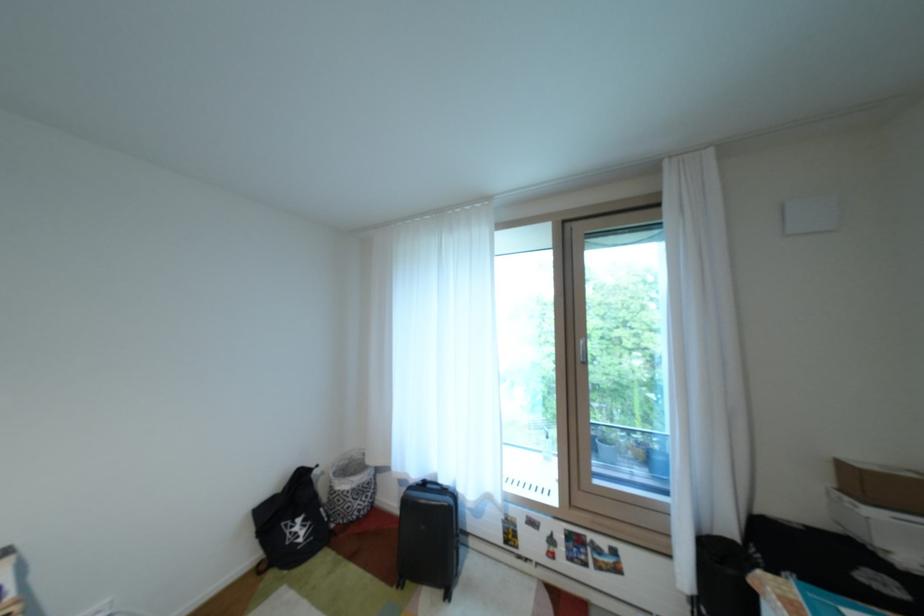
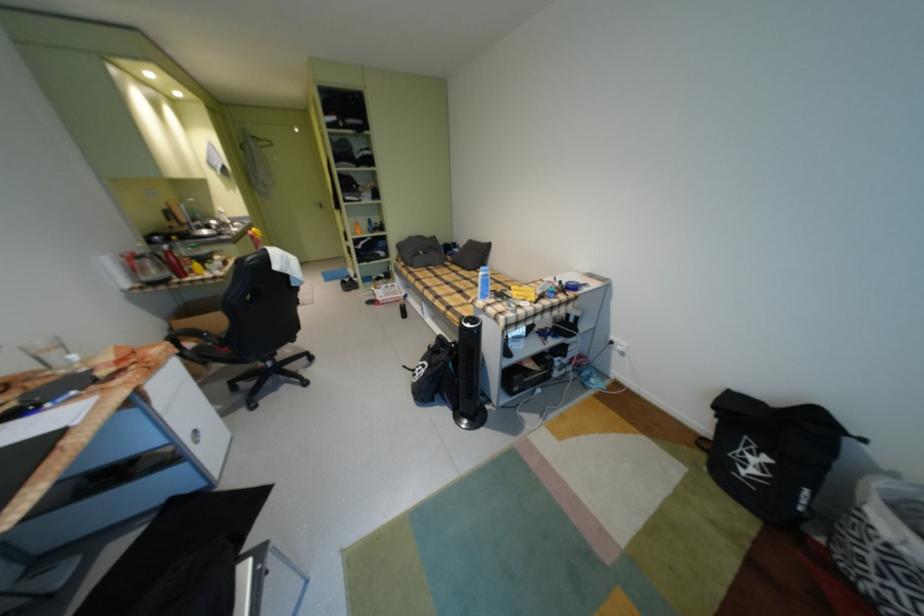
Where in the second image is the point corresponding to (x=310, y=546) from the first image?

(748, 474)